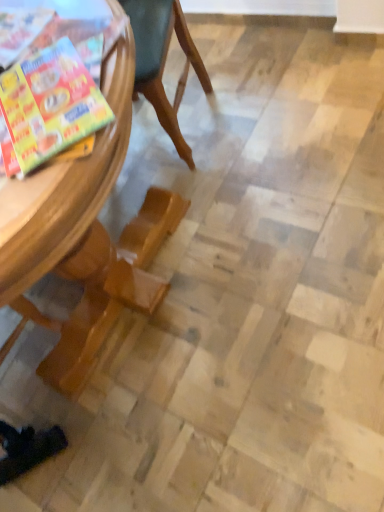
The image size is (384, 512). What do you see at coordinates (84, 234) in the screenshot?
I see `wooden chair at center` at bounding box center [84, 234].

Find the location of `wooden chair at center`. wooden chair at center is located at coordinates (84, 234).

Find the location of `wooden chair at center`. wooden chair at center is located at coordinates (84, 234).